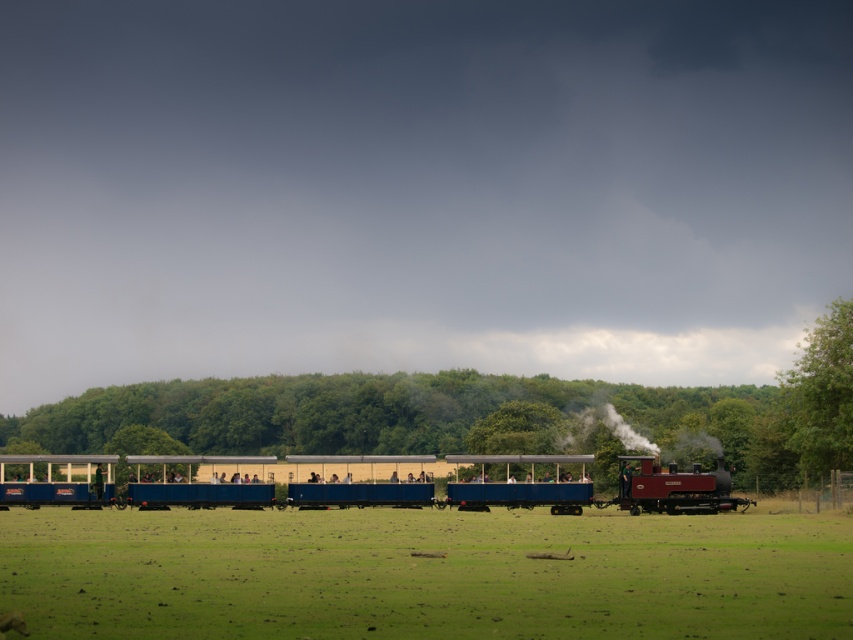
Is green grass at lower center smaller than blue painted wood train at center?

No, green grass at lower center is not smaller than blue painted wood train at center.

Is green grass at lower center to the right of blue painted wood train at center from the viewer's perspective?

Yes, green grass at lower center is to the right of blue painted wood train at center.

This screenshot has height=640, width=853. What do you see at coordinates (425, 573) in the screenshot?
I see `green grass at lower center` at bounding box center [425, 573].

This screenshot has height=640, width=853. Identify the location of green grass at lower center. pos(425,573).

Is green leafy tree at right to the right of polished wood steam engine at center from the viewer's perspective?

Correct, you'll find green leafy tree at right to the right of polished wood steam engine at center.

Identify the location of green leafy tree at right. Image resolution: width=853 pixels, height=640 pixels. (821, 394).

What do you see at coordinates (425, 573) in the screenshot?
I see `green grass at lower center` at bounding box center [425, 573].

Is point (344, 584) less distant than point (833, 394)?

Yes, point (344, 584) is closer to viewer.

Is point (397, 524) behind point (824, 324)?

No, (397, 524) is closer to viewer.

The image size is (853, 640). What are the coordinates of `green grass at lower center` in the screenshot? It's located at (425, 573).